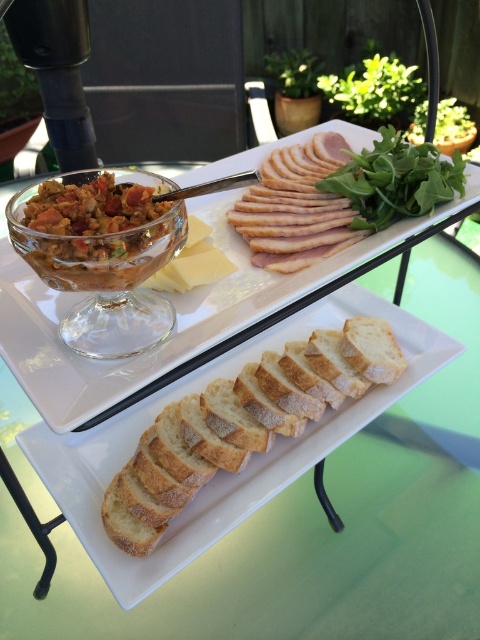
Is point (191, 547) farther from viewer compared to point (104, 260)?

No, it is not.

This screenshot has height=640, width=480. Describe the element at coordinates (223, 474) in the screenshot. I see `golden brown crusty bread at center` at that location.

Where is `golden brown crusty bread at center`? The width and height of the screenshot is (480, 640). golden brown crusty bread at center is located at coordinates (223, 474).

Between sliced bread at center and golden brown crusty bread at center, which one is positioned lower?

golden brown crusty bread at center is below.

Consider the image. Who is more forward, (x=193, y=330) or (x=99, y=541)?

Point (x=99, y=541) is more forward.

Image resolution: width=480 pixels, height=640 pixels. In order to click on sliced bread at center in this screenshot , I will do `click(176, 310)`.

Between point (312, 400) and point (104, 284), which one is positioned in front?

Point (104, 284) is in front.

How distant is golden brown crusty bread at lower center from matte glass bowl of mixed vegetables at center-left?

3.66 inches

Does point (330, 337) come farther from viewer compared to point (51, 236)?

Yes, point (330, 337) is behind point (51, 236).

What are the coordinates of `golden brown crusty bread at lower center` in the screenshot? It's located at (241, 422).